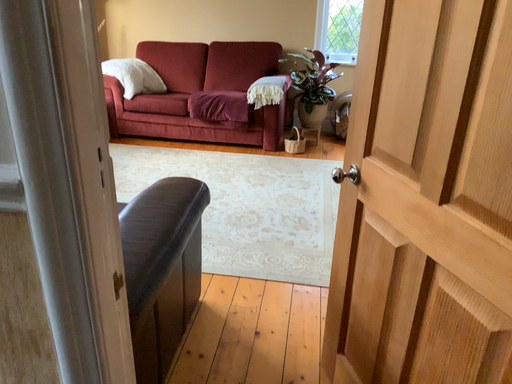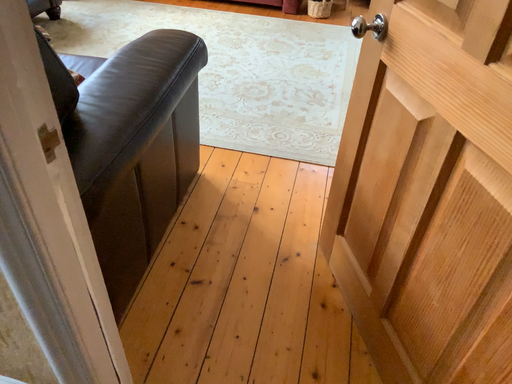
Question: How did the camera likely rotate when shooting the video?

Choices:
 (A) rotated upward
 (B) rotated downward

Answer: (B)